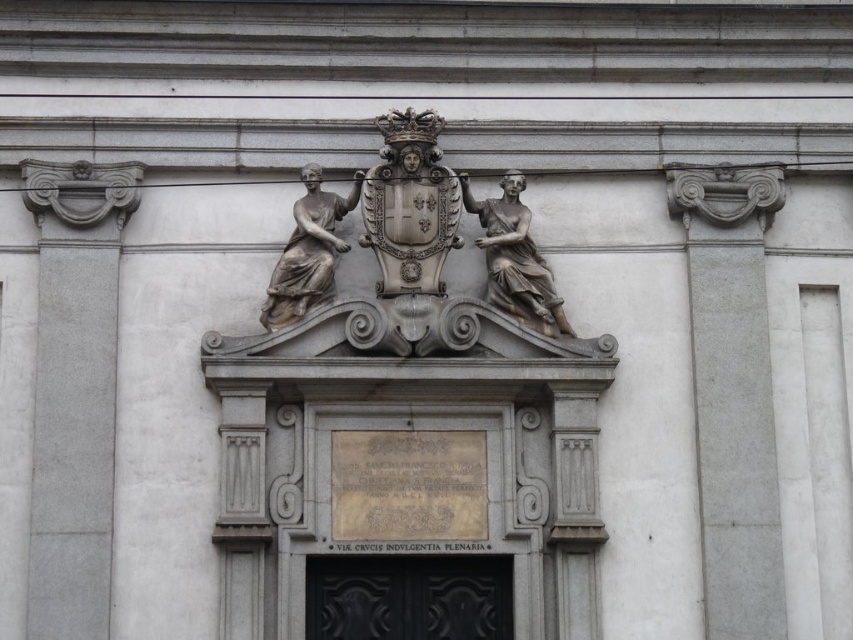
Can you confirm if sandy brown stone statue at center is positioned to the right of silver metallic statue at center?

Indeed, sandy brown stone statue at center is positioned on the right side of silver metallic statue at center.

Who is more forward, (503, 228) or (306, 272)?

Positioned in front is point (306, 272).

Locate an element on the screen. This screenshot has height=640, width=853. sandy brown stone statue at center is located at coordinates (515, 259).

Does white stone column at left appear under sandy brown stone statue at center?

Result: Yes.

Can you confirm if white stone column at left is positioned above sandy brown stone statue at center?

No, white stone column at left is not above sandy brown stone statue at center.

Describe the element at coordinates (74, 392) in the screenshot. The image size is (853, 640). I see `white stone column at left` at that location.

Where is `white stone column at left`? Image resolution: width=853 pixels, height=640 pixels. white stone column at left is located at coordinates (74, 392).

Between black polished wood door at center and sandy brown stone statue at center, which one appears on the left side from the viewer's perspective?

black polished wood door at center

Who is lower down, black polished wood door at center or sandy brown stone statue at center?

black polished wood door at center is below.

The image size is (853, 640). In order to click on black polished wood door at center in this screenshot , I will do `click(408, 596)`.

The width and height of the screenshot is (853, 640). Find the location of `black polished wood door at center`. black polished wood door at center is located at coordinates (408, 596).